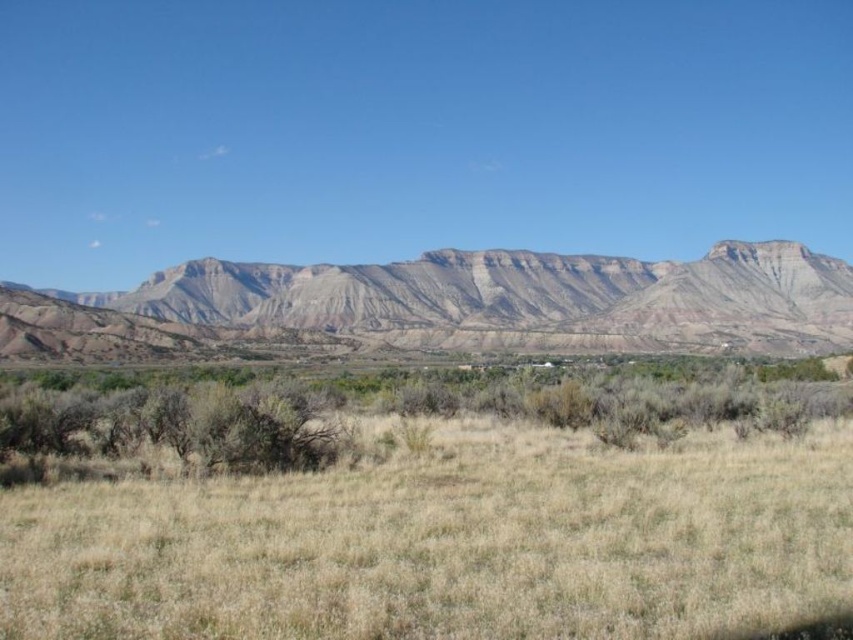
Consider the image. Can you confirm if dry grassland at center is shorter than rustic rock mountain range at center?

Correct, dry grassland at center is not as tall as rustic rock mountain range at center.

Is dry grassland at center thinner than rustic rock mountain range at center?

Yes.

What are the coordinates of `dry grassland at center` in the screenshot? It's located at (428, 508).